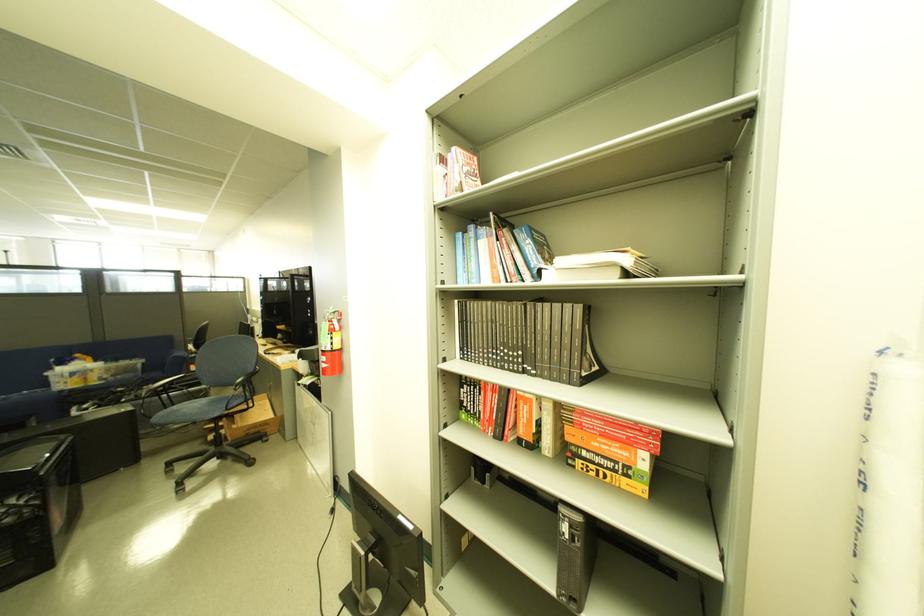
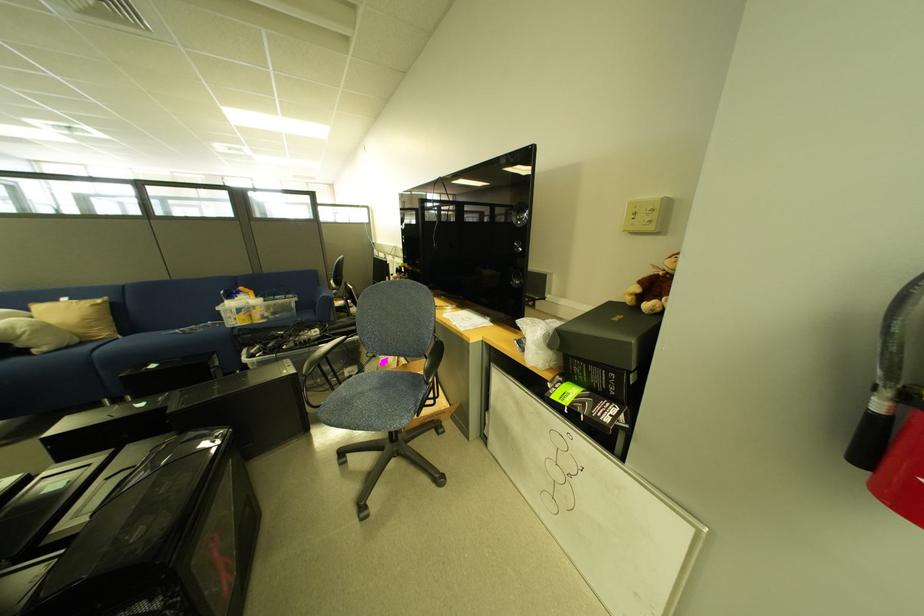
Locate, in the second image, the point that corresponds to (165,377) in the first image.

(319, 318)